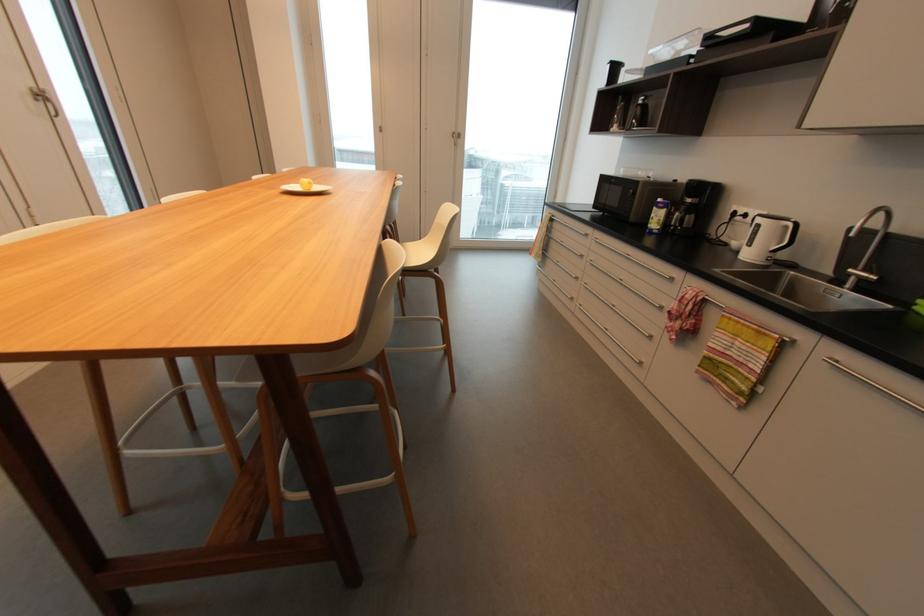
Find where to lift the white kettle handle. Please return your answer as a coordinate pair (x, y).

(793, 238)